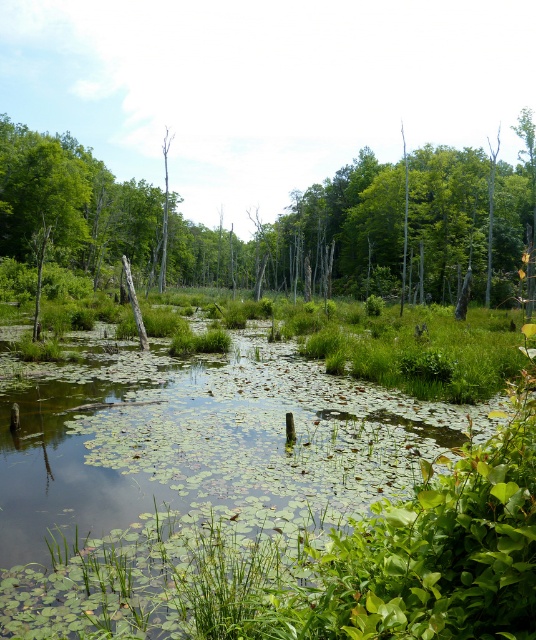
Question: Does green leafy vegetation at center appear on the left side of green matte tree at center?

Choices:
 (A) no
 (B) yes

Answer: (A)

Question: Which of the following is the closest to the observer?

Choices:
 (A) green leafy vegetation at center
 (B) green matte tree at center

Answer: (A)

Question: Is green leafy vegetation at center wider than green matte tree at center?

Choices:
 (A) yes
 (B) no

Answer: (B)

Question: Can you confirm if green leafy vegetation at center is smaller than green matte tree at center?

Choices:
 (A) no
 (B) yes

Answer: (B)

Question: Which of the following is the closest to the observer?

Choices:
 (A) green matte tree at center
 (B) green leafy vegetation at center

Answer: (B)